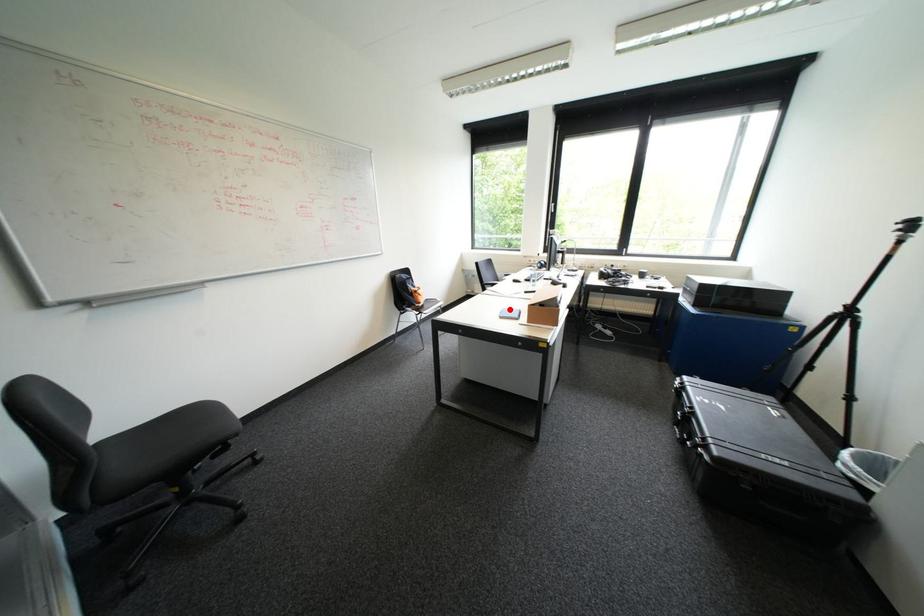
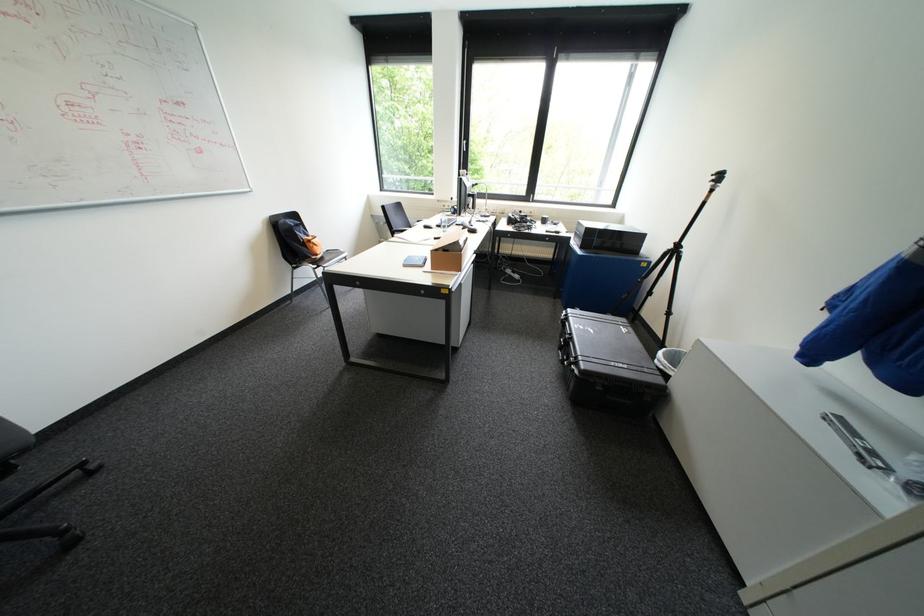
Where in the second image is the point corresponding to the highlighted location from the first image?

(415, 257)